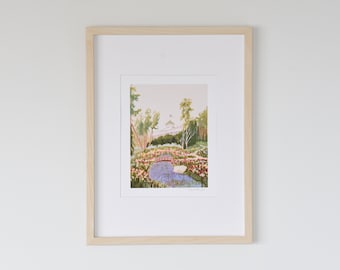
In order to click on bottom left corner of painting in this screenshot , I will do `click(131, 186)`.